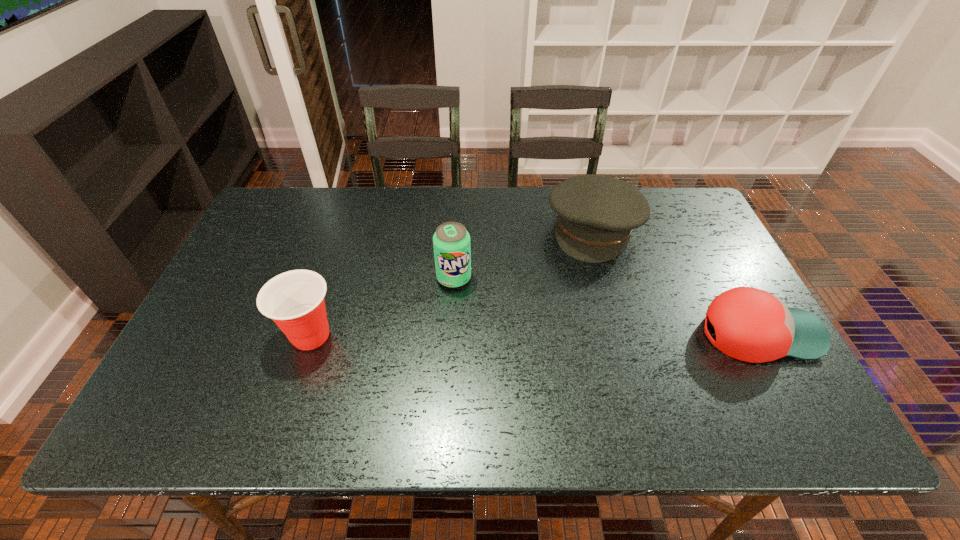
I want to click on vacant space at the near edge of the desktop, so click(x=256, y=373).

This screenshot has height=540, width=960. I want to click on vacant area at the left edge, so click(283, 271).

Image resolution: width=960 pixels, height=540 pixels. I want to click on vacant space at the right edge, so click(x=726, y=287).

Find the location of `vacant area at the far left corner of the desktop`. vacant area at the far left corner of the desktop is located at coordinates (286, 232).

I want to click on free space at the far right corner of the desktop, so click(690, 206).

You are a GUI agent. You are given a task and a screenshot of the screen. Output one action in this format:
    pyautogui.click(x=<x>, y=<y>)
    Task: Click on the free spot between the second object from right to left and the shortest object
    Image resolution: width=960 pixels, height=540 pixels.
    Given the screenshot: What is the action you would take?
    pyautogui.click(x=676, y=281)

Where is `empty space that is in between the second object from right to left and the rightmost object`? This screenshot has width=960, height=540. empty space that is in between the second object from right to left and the rightmost object is located at coordinates (676, 281).

You are a GUI agent. You are given a task and a screenshot of the screen. Output one action in this format:
    pyautogui.click(x=<x>, y=<y>)
    Task: Click on the unoccupied area between the rightmost object and the farthest object
    
    Given the screenshot: What is the action you would take?
    pyautogui.click(x=676, y=281)

This screenshot has height=540, width=960. In order to click on free point between the second farthest object and the leftmost object in this screenshot , I will do `click(382, 307)`.

The image size is (960, 540). In order to click on free spot between the baseball cap and the pop soda in this screenshot , I will do `click(607, 306)`.